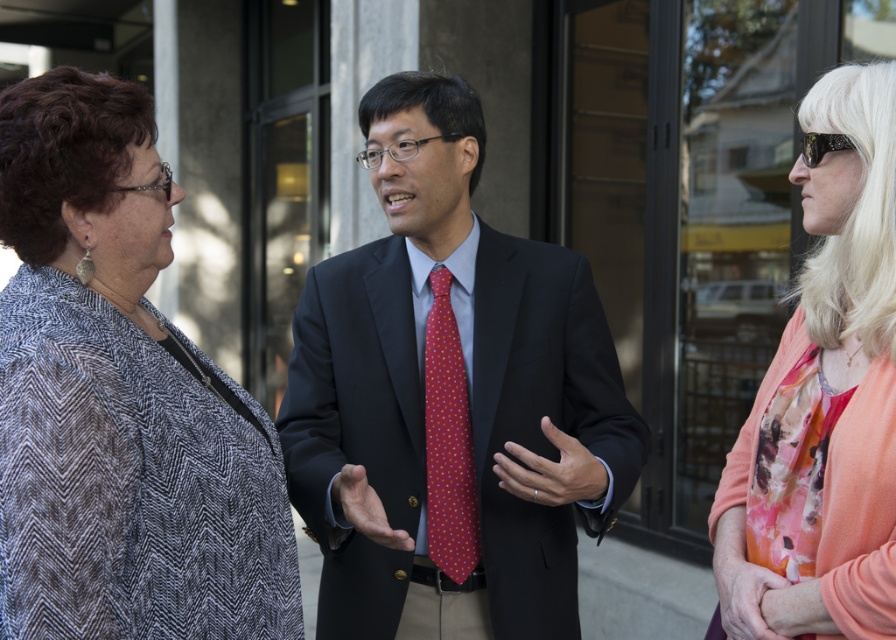
You are a tailor who needs to adjust the fit of the matte black suit at center and the polka dot silk tie at center. Which item requires more fabric to accommodate a larger size?

The matte black suit at center requires more fabric to accommodate a larger size since it is already larger than the polka dot silk tie at center.

You are a photographer trying to capture a closeup of the matte black suit at center and the polka dot silk tie at center. Since you can only focus on one object at a time, which one should you focus on first if you want to ensure the other is in the background?

The matte black suit at center is positioned on the right side of the polka dot silk tie at center, so you should focus on the polka dot silk tie at center first to have the matte black suit at center in the background.